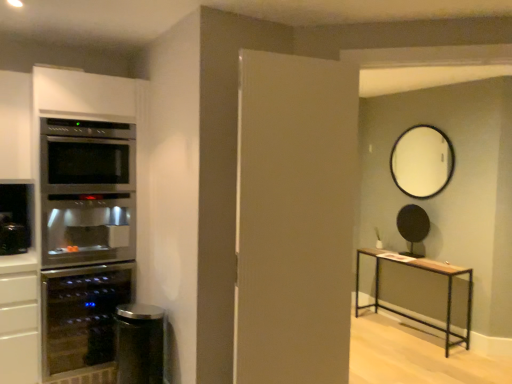
Question: Is black matte round mirror at upper center, which appears as the third appliance when viewed from the left, thinner than matte glass wine cooler at left, the second appliance from the front?

Choices:
 (A) no
 (B) yes

Answer: (B)

Question: Considering the relative sizes of black matte round mirror at upper center, which appears as the third appliance when viewed from the left, and matte glass wine cooler at left, which is counted as the third appliance, starting from the right, in the image provided, is black matte round mirror at upper center, which appears as the third appliance when viewed from the left, shorter than matte glass wine cooler at left, which is counted as the third appliance, starting from the right,?

Choices:
 (A) no
 (B) yes

Answer: (B)

Question: Could you tell me if black matte round mirror at upper center, which appears as the third appliance when viewed from the left, is turned towards matte glass wine cooler at left, the second appliance from the front?

Choices:
 (A) yes
 (B) no

Answer: (A)

Question: Is black matte round mirror at upper center, acting as the 3th appliance starting from the front, positioned far away from matte glass wine cooler at left, which is counted as the third appliance, starting from the right?

Choices:
 (A) yes
 (B) no

Answer: (A)

Question: From a real-world perspective, does black matte round mirror at upper center, which is the 1th appliance in back-to-front order, stand above matte glass wine cooler at left, which is counted as the third appliance, starting from the right?

Choices:
 (A) yes
 (B) no

Answer: (A)

Question: From a real-world perspective, relative to stainless steel fridge at left, is satin black trash can at lower left, arranged as the 2th appliance when viewed from the left, vertically above or below?

Choices:
 (A) below
 (B) above

Answer: (A)

Question: Is satin black trash can at lower left, arranged as the 2th appliance when viewed from the left, to the left or to the right of stainless steel fridge at left in the image?

Choices:
 (A) right
 (B) left

Answer: (A)

Question: Is satin black trash can at lower left, the third appliance in the back-to-front sequence, wider or thinner than stainless steel fridge at left?

Choices:
 (A) thin
 (B) wide

Answer: (A)

Question: Considering their positions, is satin black trash can at lower left, positioned as the 2th appliance in right-to-left order, located in front of or behind stainless steel fridge at left?

Choices:
 (A) front
 (B) behind

Answer: (A)

Question: From the image's perspective, is white glossy mirror at upper center located above or below white matte door at center?

Choices:
 (A) above
 (B) below

Answer: (A)

Question: Is white glossy mirror at upper center spatially inside white matte door at center, or outside of it?

Choices:
 (A) outside
 (B) inside

Answer: (A)

Question: Is point (430, 135) positioned closer to the camera than point (303, 155)?

Choices:
 (A) closer
 (B) farther

Answer: (B)

Question: Is white glossy mirror at upper center taller or shorter than white matte door at center?

Choices:
 (A) tall
 (B) short

Answer: (B)

Question: In terms of size, does matte glass wine cooler at left, which is the 1th appliance in left-to-right order, appear bigger or smaller than stainless steel fridge at left?

Choices:
 (A) small
 (B) big

Answer: (A)

Question: Considering their positions, is matte glass wine cooler at left, which is counted as the third appliance, starting from the right, located in front of or behind stainless steel fridge at left?

Choices:
 (A) behind
 (B) front

Answer: (A)